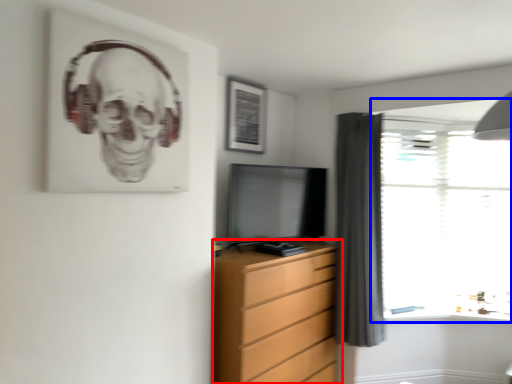
Question: Which point is further to the camera, chest of drawers (highlighted by a red box) or window (highlighted by a blue box)?

Choices:
 (A) chest of drawers
 (B) window

Answer: (B)